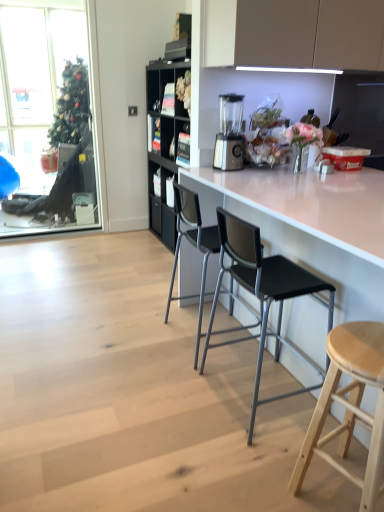
Question: From the image's perspective, is black plastic chair at center, which is the 2th chair from front to back, under clear glass window at upper left?

Choices:
 (A) yes
 (B) no

Answer: (A)

Question: Considering the relative positions of black plastic chair at center, the 1th chair in the back-to-front sequence, and clear glass window at upper left in the image provided, is black plastic chair at center, the 1th chair in the back-to-front sequence, to the right of clear glass window at upper left from the viewer's perspective?

Choices:
 (A) no
 (B) yes

Answer: (B)

Question: Is clear glass window at upper left surrounded by black plastic chair at center, which is the 2th chair from front to back?

Choices:
 (A) no
 (B) yes

Answer: (A)

Question: Can you confirm if black plastic chair at center, the 1th chair in the back-to-front sequence, is taller than clear glass window at upper left?

Choices:
 (A) no
 (B) yes

Answer: (A)

Question: Does black plastic chair at center, which is the 2th chair from front to back, have a larger size compared to clear glass window at upper left?

Choices:
 (A) no
 (B) yes

Answer: (B)

Question: Is black plastic chair at center, the 1th chair in the back-to-front sequence, in front of clear glass window at upper left?

Choices:
 (A) yes
 (B) no

Answer: (A)

Question: Is white glossy counter at center with light wood stool at lower right?

Choices:
 (A) no
 (B) yes

Answer: (A)

Question: Does white glossy counter at center have a greater height compared to light wood stool at lower right?

Choices:
 (A) no
 (B) yes

Answer: (B)

Question: Would you say white glossy counter at center contains light wood stool at lower right?

Choices:
 (A) no
 (B) yes

Answer: (B)

Question: Is white glossy counter at center positioned in front of light wood stool at lower right?

Choices:
 (A) no
 (B) yes

Answer: (B)

Question: From the image's perspective, is white glossy counter at center located beneath light wood stool at lower right?

Choices:
 (A) no
 (B) yes

Answer: (A)

Question: Is white glossy counter at center wider than light wood stool at lower right?

Choices:
 (A) no
 (B) yes

Answer: (B)

Question: From the image's perspective, is light wood stool at lower right located beneath satin silver blender at center?

Choices:
 (A) yes
 (B) no

Answer: (A)